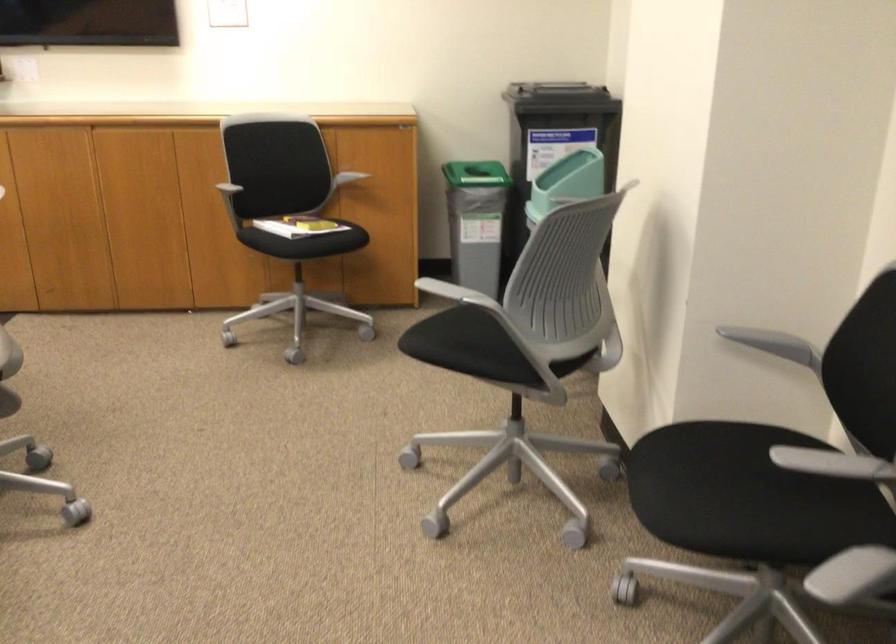
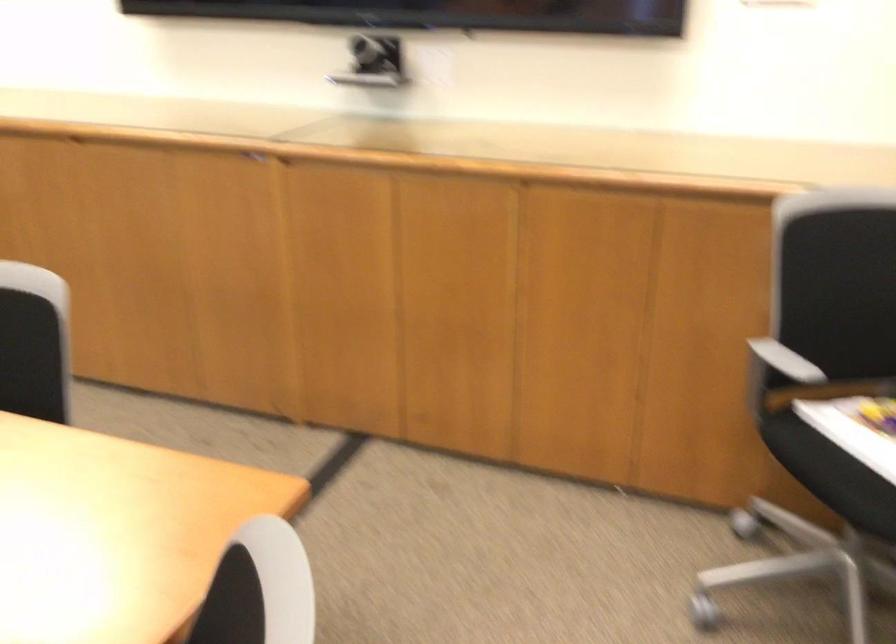
Where in the second image is the point corresponding to [230,190] from the first image?

(778, 374)